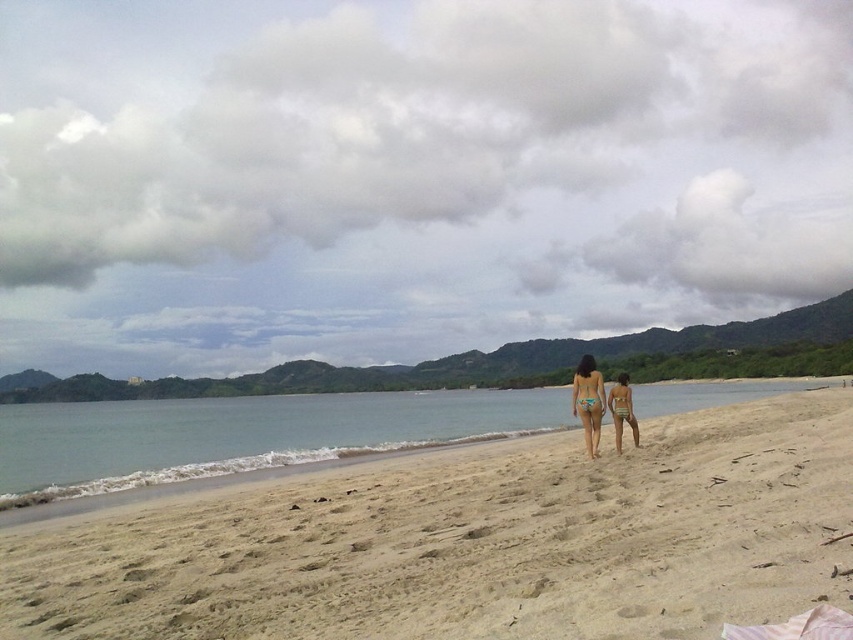
Question: Is light blue fabric bikini at center wider than green striped bikini at center?

Choices:
 (A) yes
 (B) no

Answer: (A)

Question: Which object is closer to the camera taking this photo?

Choices:
 (A) green textured bikini at center
 (B) light beige sand at center
 (C) teal bikini at center
 (D) green striped bikini at center

Answer: (B)

Question: Among these objects, which one is nearest to the camera?

Choices:
 (A) light blue fabric bikini at center
 (B) green textured bikini at center

Answer: (A)

Question: Does light beige sand at center appear over teal bikini at center?

Choices:
 (A) no
 (B) yes

Answer: (A)

Question: Which of the following is the closest to the observer?

Choices:
 (A) teal bikini at center
 (B) light blue fabric bikini at center
 (C) green textured bikini at center

Answer: (B)

Question: Can you confirm if teal bikini at center is positioned above green textured bikini at center?

Choices:
 (A) yes
 (B) no

Answer: (B)